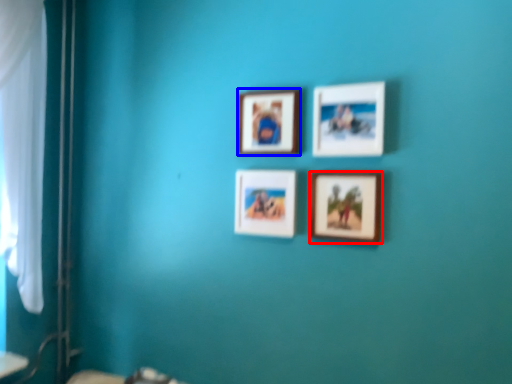
Question: Which object appears farthest to the camera in this image, picture frame (highlighted by a red box) or picture frame (highlighted by a blue box)?

Choices:
 (A) picture frame
 (B) picture frame

Answer: (B)